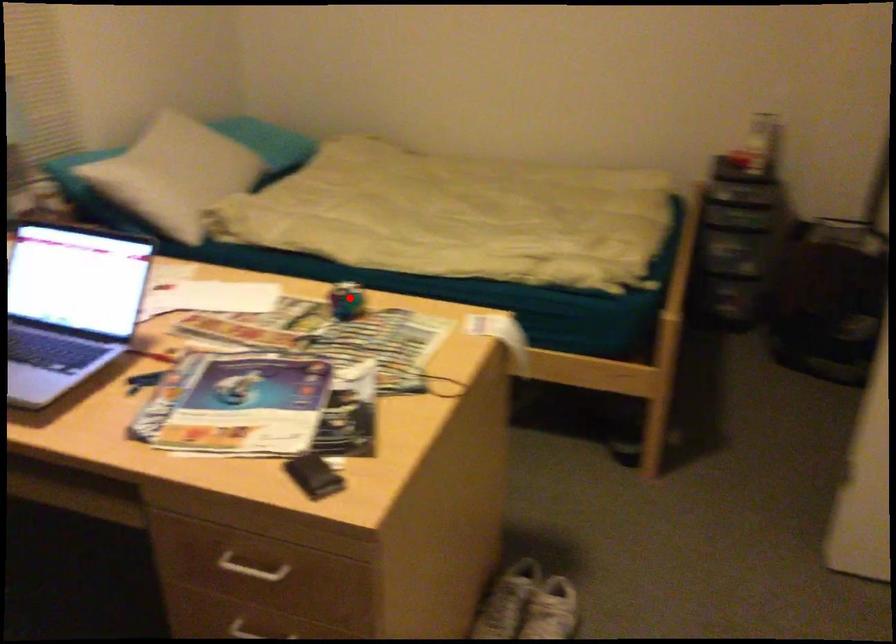
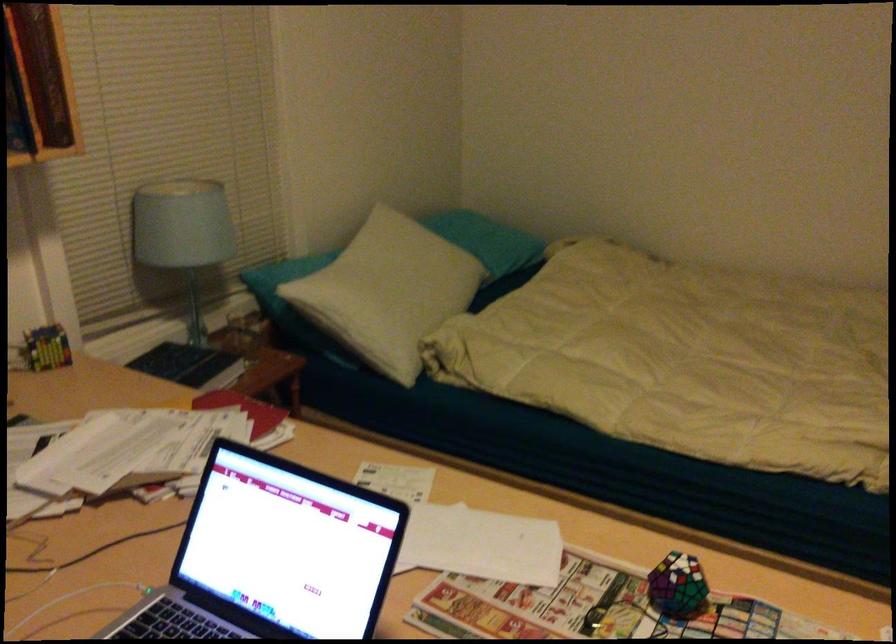
Question: I am providing you with two images of the same scene from different viewpoints. A red point is shown in image1. For the corresponding object point in image2, is it positioned nearer or farther from the camera?

Choices:
 (A) Nearer
 (B) Farther

Answer: (A)